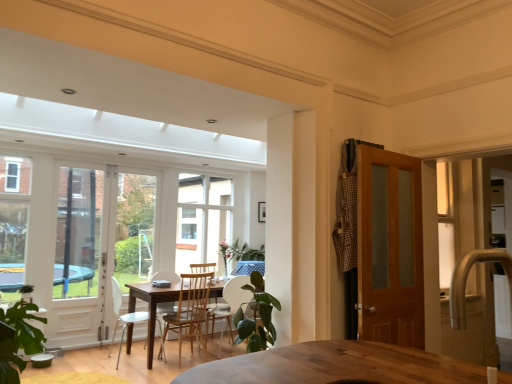
Question: Does gold textured faucet at right come behind wooden chair at center, the third chair when ordered from left to right?

Choices:
 (A) yes
 (B) no

Answer: (B)

Question: From the image's perspective, is gold textured faucet at right over wooden chair at center, marked as the 1th chair in a right-to-left arrangement?

Choices:
 (A) no
 (B) yes

Answer: (B)

Question: Could you tell me if gold textured faucet at right is facing wooden chair at center, marked as the 1th chair in a right-to-left arrangement?

Choices:
 (A) yes
 (B) no

Answer: (B)

Question: From the image's perspective, would you say gold textured faucet at right is shown under wooden chair at center, marked as the 1th chair in a right-to-left arrangement?

Choices:
 (A) no
 (B) yes

Answer: (A)

Question: Is gold textured faucet at right not near wooden chair at center, the third chair when ordered from left to right?

Choices:
 (A) yes
 (B) no

Answer: (A)

Question: Is gold textured faucet at right in contact with wooden chair at center, the third chair when ordered from left to right?

Choices:
 (A) no
 (B) yes

Answer: (A)

Question: From the image's perspective, is wooden chair at center, marked as the 2th chair in a right-to-left arrangement, over white glass window at center?

Choices:
 (A) no
 (B) yes

Answer: (A)

Question: Is wooden chair at center, marked as the 2th chair in a right-to-left arrangement, to the right of white glass window at center from the viewer's perspective?

Choices:
 (A) yes
 (B) no

Answer: (B)

Question: Could you tell me if wooden chair at center, which appears as the 2th chair when viewed from the left, is turned towards white glass window at center?

Choices:
 (A) no
 (B) yes

Answer: (A)

Question: Considering the relative sizes of wooden chair at center, which appears as the 2th chair when viewed from the left, and white glass window at center in the image provided, is wooden chair at center, which appears as the 2th chair when viewed from the left, taller than white glass window at center?

Choices:
 (A) yes
 (B) no

Answer: (B)

Question: Is wooden chair at center, which appears as the 2th chair when viewed from the left, thinner than white glass window at center?

Choices:
 (A) no
 (B) yes

Answer: (A)

Question: From the image's perspective, does wooden chair at center, marked as the 2th chair in a right-to-left arrangement, appear lower than white glass window at center?

Choices:
 (A) yes
 (B) no

Answer: (A)

Question: Is metallic silver table at center in front of white glass window at center?

Choices:
 (A) no
 (B) yes

Answer: (A)